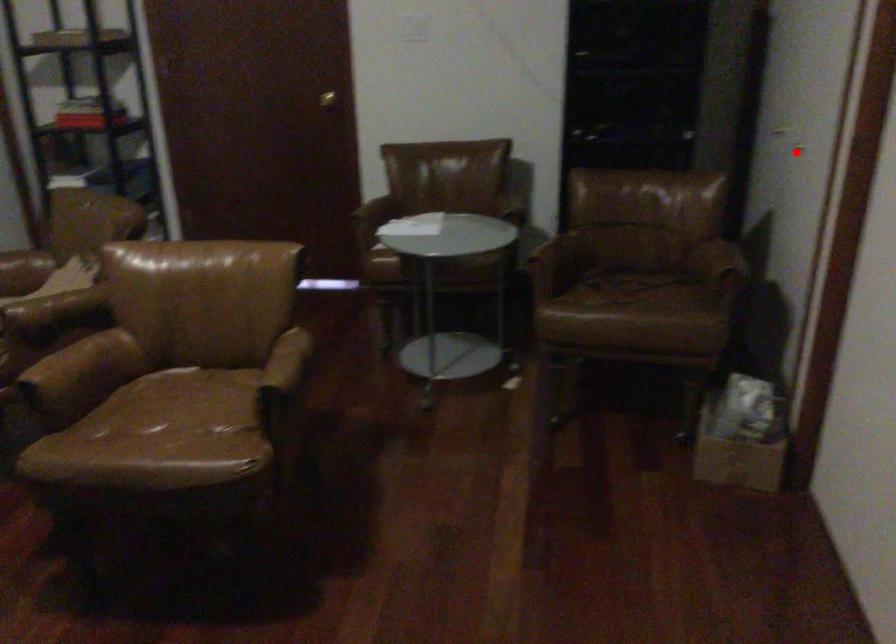
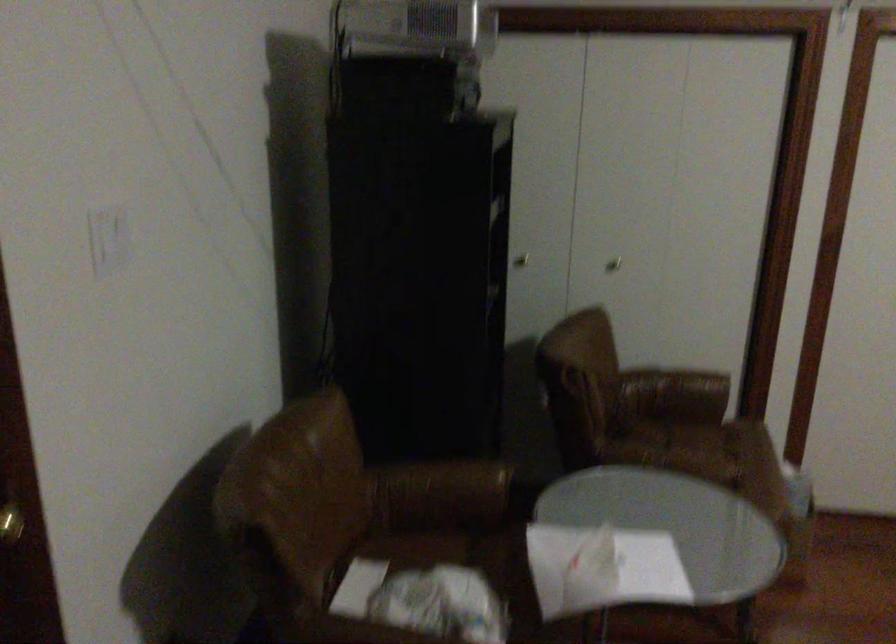
The point at the highlighted location is marked in the first image. Where is the corresponding point in the second image?

(613, 263)